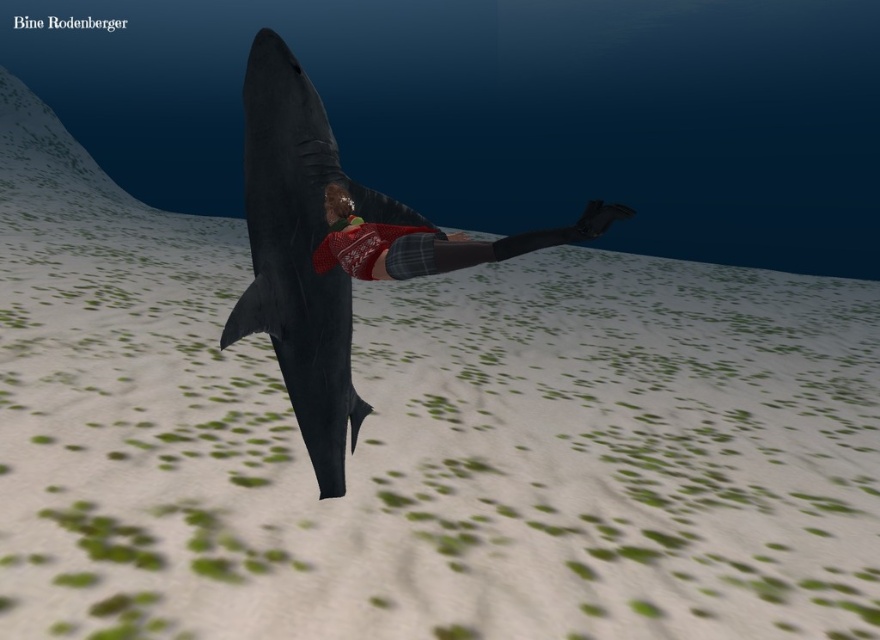
You are a marine biologist observing this underwater scene. You notice the shiny black shark at center and the sweater at center. Which object is wider?

The sweater at center is wider than the shiny black shark at center.

You are a photographer taking a picture of the shark and the human figure in its mouth. You want to focus on the point closer to the camera. Which point should you choose between point (247, 173) and point (464, 264)?

Point (247, 173) is further to the camera than point (464, 264), so you should choose point (247, 173) to focus on the closer point.

You are a marine biologist observing the underwater scene. You notice the shiny black shark at center and the sweater at center. Which object is taller?

The shiny black shark at center is taller than the sweater at center.